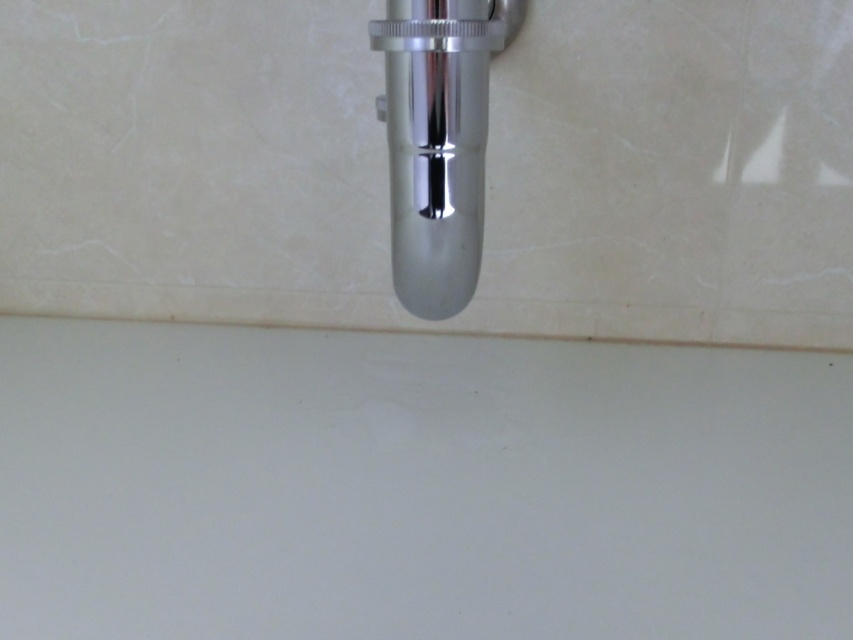
Looking at this image, you are trying to clean the bathroom sink area. You have a 12 inch long cleaning cloth. If you place the cloth on the white matte sink at bottom, will it reach the polished chrome faucet at center?

The white matte sink at bottom is 11.71 inches away from the polished chrome faucet at center. Since the cloth is 12 inches long, it can just barely reach the polished chrome faucet at center when placed on the white matte sink at bottom.

You are standing in front of the bathroom sink area shown in the image. There is a point marked at coordinates (416, 486). What object is located at that point?

The white matte sink at bottom is located at point (416, 486).

You are a plumber inspecting a bathroom sink area. You see the white matte sink at bottom and the polished chrome faucet at center. Which object is closer to you from your current viewpoint?

The white matte sink at bottom is closer to you because it is in front of the polished chrome faucet at center.